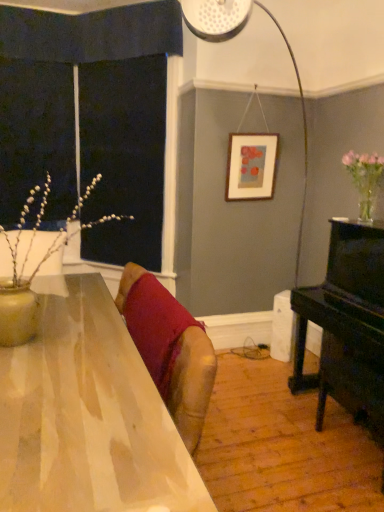
Question: Does velvet red cushion at center lie behind shiny wooden table at center?

Choices:
 (A) yes
 (B) no

Answer: (A)

Question: From a real-world perspective, is velvet red cushion at center located higher than shiny wooden table at center?

Choices:
 (A) no
 (B) yes

Answer: (B)

Question: Can you confirm if velvet red cushion at center is smaller than shiny wooden table at center?

Choices:
 (A) no
 (B) yes

Answer: (B)

Question: From the image's perspective, is velvet red cushion at center under shiny wooden table at center?

Choices:
 (A) yes
 (B) no

Answer: (B)

Question: Does velvet red cushion at center turn towards shiny wooden table at center?

Choices:
 (A) no
 (B) yes

Answer: (B)

Question: From the image's perspective, is velvet red cushion at center positioned above or below translucent glass vase at right?

Choices:
 (A) below
 (B) above

Answer: (A)

Question: Considering the relative positions of velvet red cushion at center and translucent glass vase at right in the image provided, is velvet red cushion at center to the left or to the right of translucent glass vase at right?

Choices:
 (A) right
 (B) left

Answer: (B)

Question: Is velvet red cushion at center in front of or behind translucent glass vase at right in the image?

Choices:
 (A) front
 (B) behind

Answer: (A)

Question: Is velvet red cushion at center inside or outside of translucent glass vase at right?

Choices:
 (A) inside
 (B) outside

Answer: (B)

Question: Considering the positions of shiny wooden table at center and matte wooden picture frame at upper center in the image, is shiny wooden table at center wider or thinner than matte wooden picture frame at upper center?

Choices:
 (A) thin
 (B) wide

Answer: (B)

Question: From the image's perspective, is shiny wooden table at center located above or below matte wooden picture frame at upper center?

Choices:
 (A) below
 (B) above

Answer: (A)

Question: Is shiny wooden table at center in front of or behind matte wooden picture frame at upper center in the image?

Choices:
 (A) front
 (B) behind

Answer: (A)

Question: Based on their sizes in the image, would you say shiny wooden table at center is bigger or smaller than matte wooden picture frame at upper center?

Choices:
 (A) big
 (B) small

Answer: (A)

Question: Is shiny wooden table at center wider or thinner than black polished piano at right?

Choices:
 (A) thin
 (B) wide

Answer: (B)

Question: Is shiny wooden table at center bigger or smaller than black polished piano at right?

Choices:
 (A) big
 (B) small

Answer: (A)